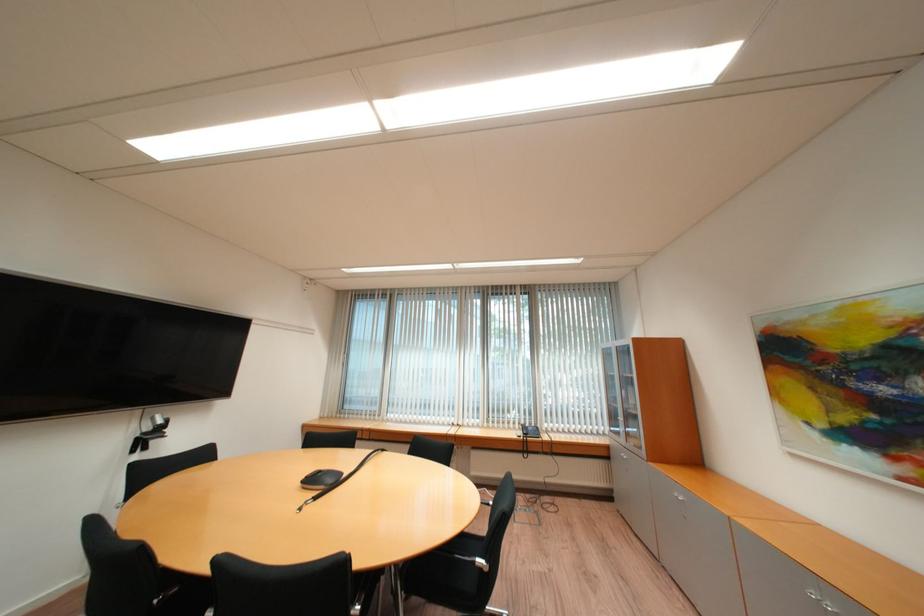
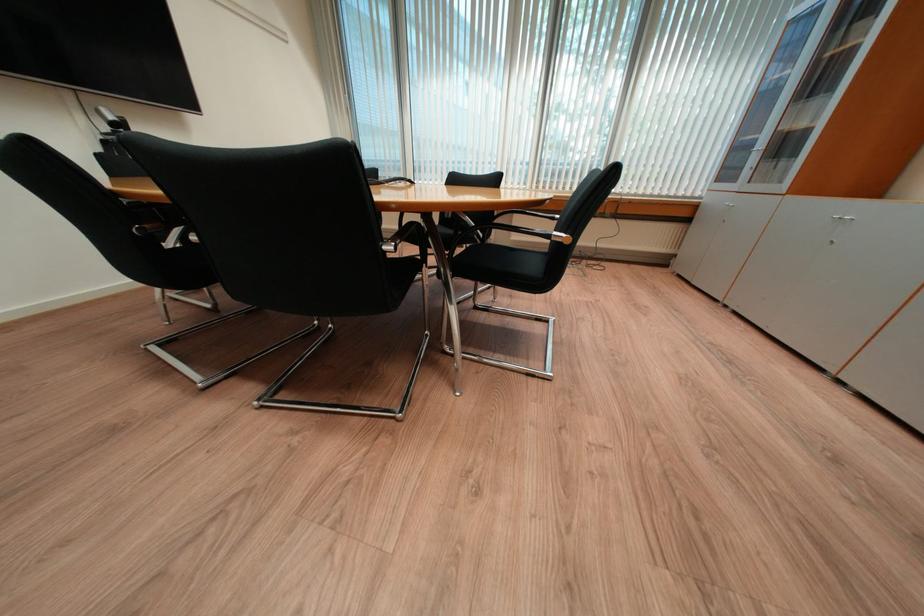
Question: How did the camera likely rotate?

Choices:
 (A) Left
 (B) Right
 (C) Up
 (D) Down

Answer: (D)